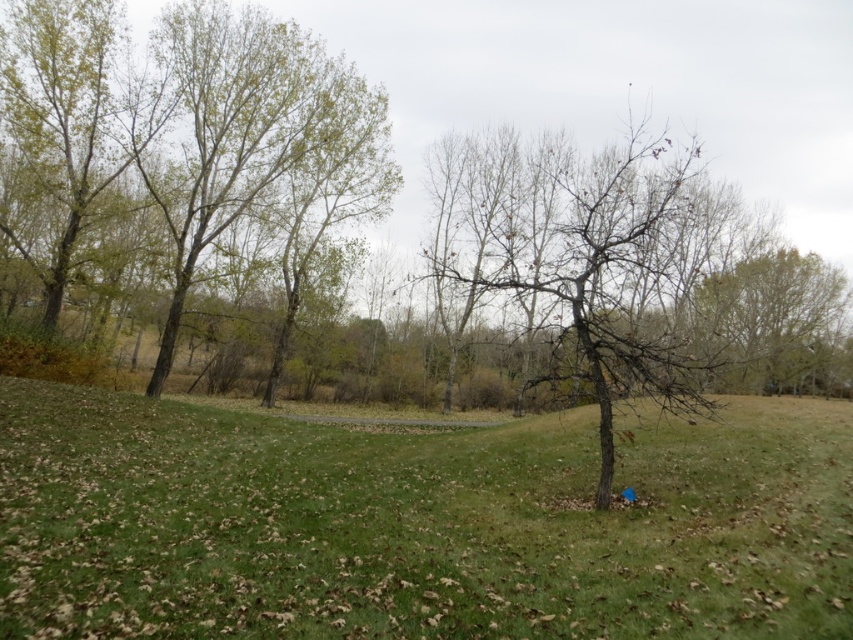
Which is behind, point (169, 458) or point (184, 67)?

Point (184, 67)

Can you confirm if green grassy at lower left is wider than green leafy tree at upper left?

Yes.

This screenshot has height=640, width=853. Identify the location of green grassy at lower left. (416, 525).

Who is shorter, bare wood tree at center or green leafy tree at upper left?

green leafy tree at upper left is shorter.

Is bare wood tree at center to the left of green leafy tree at upper left from the viewer's perspective?

Incorrect, bare wood tree at center is not on the left side of green leafy tree at upper left.

Which is in front, point (634, 333) or point (151, 129)?

Positioned in front is point (634, 333).

Identify the location of bare wood tree at center. (614, 273).

Which is in front, point (15, 508) or point (535, 332)?

Point (15, 508) is more forward.

Measure the distance between green grassy at lower left and bare wood tree at center.

green grassy at lower left is 36.28 feet away from bare wood tree at center.

Find the location of `green grassy at lower left`. green grassy at lower left is located at coordinates 416,525.

In order to click on green grassy at lower left in this screenshot , I will do `click(416, 525)`.